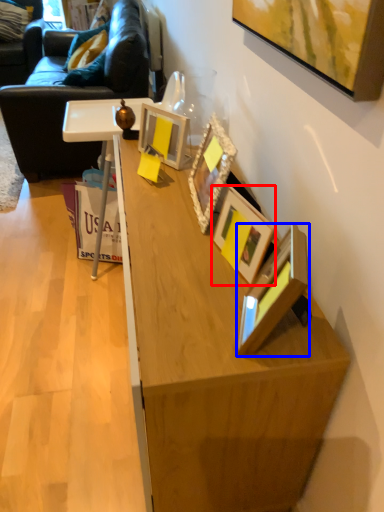
Question: Which point is closer to the camera, picture frame (highlighted by a red box) or picture frame (highlighted by a blue box)?

Choices:
 (A) picture frame
 (B) picture frame

Answer: (B)